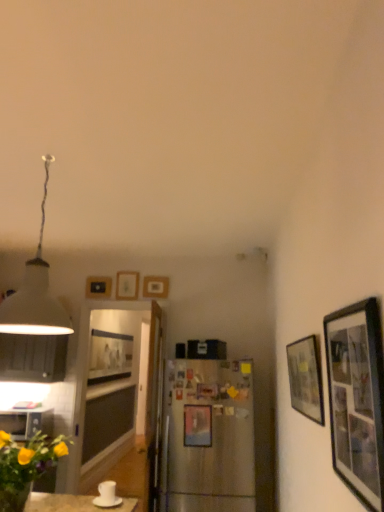
The image size is (384, 512). What do you see at coordinates (25, 466) in the screenshot?
I see `yellow matte flower at lower left` at bounding box center [25, 466].

What do you see at coordinates (35, 293) in the screenshot? Image resolution: width=384 pixels, height=512 pixels. I see `white matte lampshade at upper left` at bounding box center [35, 293].

In order to face matte black picture frame at right, which ranks as the 6th picture frame in back-to-front order, should I rotate leftwards or rightwards?

A 14.645 degree turn to the right will do.

What is the approximate width of matte black picture frame at right, which appears as the 7th picture frame when viewed from the left?

2.04 inches.

The height and width of the screenshot is (512, 384). Identify the location of metallic silver picture frame at center, the third picture frame in the right-to-left sequence. (197, 425).

This screenshot has width=384, height=512. Describe the element at coordinates (208, 437) in the screenshot. I see `satin silver refrigerator at center` at that location.

Image resolution: width=384 pixels, height=512 pixels. I want to click on satin silver refrigerator at center, so click(208, 437).

Locate an element on the screen. The image size is (384, 512). matte wood picture frame at upper center, the 3th picture frame positioned from the left is located at coordinates (127, 285).

Considering the sizes of objects matte black picture frame at right, which ranks as the 6th picture frame in back-to-front order, and matte black picture frame at center, positioned as the seventh picture frame in right-to-left order, in the image provided, who is smaller, matte black picture frame at right, which ranks as the 6th picture frame in back-to-front order, or matte black picture frame at center, positioned as the seventh picture frame in right-to-left order,?

With smaller size is matte black picture frame at right, which ranks as the 6th picture frame in back-to-front order.

Considering the sizes of objects matte black picture frame at right, arranged as the second picture frame when viewed from the front, and matte black picture frame at center, the first picture frame viewed from the left, in the image provided, who is thinner, matte black picture frame at right, arranged as the second picture frame when viewed from the front, or matte black picture frame at center, the first picture frame viewed from the left,?

matte black picture frame at right, arranged as the second picture frame when viewed from the front.

Considering the points (306, 398) and (108, 351), which point is in front, point (306, 398) or point (108, 351)?

The point (306, 398) is closer to the camera.

Between matte wood picture frame at upper center, the third picture frame viewed from the back, and satin silver refrigerator at center, which one appears on the right side from the viewer's perspective?

satin silver refrigerator at center.

Is matte wood picture frame at upper center, the third picture frame viewed from the back, wider or thinner than satin silver refrigerator at center?

Clearly, matte wood picture frame at upper center, the third picture frame viewed from the back, has less width compared to satin silver refrigerator at center.

Does matte wood picture frame at upper center, the third picture frame viewed from the back, turn towards satin silver refrigerator at center?

No, matte wood picture frame at upper center, the third picture frame viewed from the back, is not turned towards satin silver refrigerator at center.

Considering the positions of objects satin silver refrigerator at center and matte black picture frame at center, positioned as the seventh picture frame in right-to-left order, in the image provided, who is more to the left, satin silver refrigerator at center or matte black picture frame at center, positioned as the seventh picture frame in right-to-left order,?

matte black picture frame at center, positioned as the seventh picture frame in right-to-left order, is more to the left.

Can you confirm if satin silver refrigerator at center is shorter than matte black picture frame at center, positioned as the seventh picture frame in right-to-left order?

In fact, satin silver refrigerator at center may be taller than matte black picture frame at center, positioned as the seventh picture frame in right-to-left order.

From the image's perspective, who appears lower, satin silver refrigerator at center or matte black picture frame at center, which appears as the 1th picture frame when viewed from the back?

From the image's view, matte black picture frame at center, which appears as the 1th picture frame when viewed from the back, is below.

Considering the sizes of objects satin silver refrigerator at center and matte black picture frame at center, the first picture frame viewed from the left, in the image provided, who is thinner, satin silver refrigerator at center or matte black picture frame at center, the first picture frame viewed from the left,?

With smaller width is satin silver refrigerator at center.

Looking at their sizes, would you say matte black picture frame at right, which ranks as the 6th picture frame in back-to-front order, is wider or thinner than white matte lampshade at upper left?

matte black picture frame at right, which ranks as the 6th picture frame in back-to-front order, is thinner than white matte lampshade at upper left.

From the image's perspective, is matte black picture frame at right, the 1th picture frame in the right-to-left sequence, below white matte lampshade at upper left?

Yes.

Looking at this image, considering the relative positions of matte black picture frame at right, arranged as the second picture frame when viewed from the front, and white matte lampshade at upper left in the image provided, is matte black picture frame at right, arranged as the second picture frame when viewed from the front, to the left of white matte lampshade at upper left from the viewer's perspective?

No, matte black picture frame at right, arranged as the second picture frame when viewed from the front, is not to the left of white matte lampshade at upper left.

Could you tell me if matte black picture frame at right, which appears as the 7th picture frame when viewed from the left, is turned towards white matte lampshade at upper left?

No, matte black picture frame at right, which appears as the 7th picture frame when viewed from the left, is not aimed at white matte lampshade at upper left.

Does wooden collage frame at right, the seventh picture frame in the back-to-front sequence, turn towards white matte lampshade at upper left?

Yes.

Is wooden collage frame at right, the sixth picture frame from the left, at the left side of white matte lampshade at upper left?

Incorrect, wooden collage frame at right, the sixth picture frame from the left, is not on the left side of white matte lampshade at upper left.

From a real-world perspective, is wooden collage frame at right, positioned as the second picture frame in right-to-left order, physically below white matte lampshade at upper left?

Yes, from a real-world perspective, wooden collage frame at right, positioned as the second picture frame in right-to-left order, is below white matte lampshade at upper left.

Is white matte lampshade at upper left inside wooden collage frame at right, the sixth picture frame from the left?

No, white matte lampshade at upper left is not inside wooden collage frame at right, the sixth picture frame from the left.

Which object is closer to the camera, white glossy coffee cup at lower left or metallic silver picture frame at center, which is the 5th picture frame from left to right?

white glossy coffee cup at lower left is more forward.

From a real-world perspective, starting from the white glossy coffee cup at lower left, which picture frame is the 1st one vertically above it? Please provide its 2D coordinates.

[(197, 425)]

Looking at this image, considering the relative sizes of white glossy coffee cup at lower left and metallic silver picture frame at center, the third picture frame in the right-to-left sequence, in the image provided, is white glossy coffee cup at lower left thinner than metallic silver picture frame at center, the third picture frame in the right-to-left sequence,?

In fact, white glossy coffee cup at lower left might be wider than metallic silver picture frame at center, the third picture frame in the right-to-left sequence.

Considering the sizes of objects white glossy coffee cup at lower left and metallic silver picture frame at center, which appears as the third picture frame when viewed from the front, in the image provided, who is taller, white glossy coffee cup at lower left or metallic silver picture frame at center, which appears as the third picture frame when viewed from the front,?

Standing taller between the two is metallic silver picture frame at center, which appears as the third picture frame when viewed from the front.

Does wooden collage frame at right, the sixth picture frame from the left, turn towards yellow matte flower at lower left?

Yes, wooden collage frame at right, the sixth picture frame from the left, is aimed at yellow matte flower at lower left.

Is wooden collage frame at right, the sixth picture frame from the left, not close to yellow matte flower at lower left?

That's right, there is a large distance between wooden collage frame at right, the sixth picture frame from the left, and yellow matte flower at lower left.

This screenshot has width=384, height=512. Identify the location of the 4th picture frame counting from the right of the yellow matte flower at lower left. (357, 399).

Which is further, (x=376, y=315) or (x=15, y=501)?

The point (x=15, y=501) is behind.

Identify the location of the 6th picture frame counting from the right of the matte black picture frame at center, positioned as the seventh picture frame in right-to-left order. (306, 378).

Find the location of a particular element. This screenshot has height=512, width=384. refrigerator below the matte wood picture frame at upper center, the third picture frame viewed from the back (from a real-world perspective) is located at coordinates click(208, 437).

From the image, which object appears to be nearer to wooden picture frame at upper center, which ranks as the fourth picture frame in left-to-right order, satin silver refrigerator at center or white matte lampshade at upper left?

Among the two, satin silver refrigerator at center is located nearer to wooden picture frame at upper center, which ranks as the fourth picture frame in left-to-right order.

Estimate the real-world distances between objects in this image. Which object is closer to white matte lampshade at upper left, brushed metal microwave at lower left or white glossy coffee cup at lower left?

white glossy coffee cup at lower left lies closer to white matte lampshade at upper left than the other object.

Which object lies nearer to the anchor point wooden picture frame at upper center, which is the 4th picture frame from front to back, matte black picture frame at right, which appears as the 7th picture frame when viewed from the left, or white glossy coffee cup at lower left?

white glossy coffee cup at lower left is positioned closer to the anchor wooden picture frame at upper center, which is the 4th picture frame from front to back.

Considering their positions, is matte black picture frame at center, the first picture frame viewed from the left, positioned further to metallic silver picture frame at center, the 5th picture frame viewed from the back, than matte black picture frame at upper left, positioned as the 6th picture frame in right-to-left order?

matte black picture frame at center, the first picture frame viewed from the left.

Estimate the real-world distances between objects in this image. Which object is further from white matte lampshade at upper left, matte black picture frame at upper left, arranged as the 2th picture frame when viewed from the back, or white glossy saucer at lower center?

matte black picture frame at upper left, arranged as the 2th picture frame when viewed from the back.

Looking at the image, which one is located further to yellow matte flower at lower left, metallic silver picture frame at center, the third picture frame in the right-to-left sequence, or matte black picture frame at right, which ranks as the 6th picture frame in back-to-front order?

Among the two, metallic silver picture frame at center, the third picture frame in the right-to-left sequence, is located further to yellow matte flower at lower left.

Estimate the real-world distances between objects in this image. Which object is closer to white glossy saucer at lower center, matte black picture frame at center, positioned as the seventh picture frame in right-to-left order, or white matte lampshade at upper left?

white matte lampshade at upper left is closer to white glossy saucer at lower center.

Consider the image. Which object lies nearer to the anchor point wooden picture frame at upper center, which is the 4th picture frame from front to back, matte black picture frame at upper left, which ranks as the 2th picture frame in left-to-right order, or white matte lampshade at upper left?

The object closer to wooden picture frame at upper center, which is the 4th picture frame from front to back, is matte black picture frame at upper left, which ranks as the 2th picture frame in left-to-right order.

The width and height of the screenshot is (384, 512). In order to click on refrigerator between wooden collage frame at right, positioned as the second picture frame in right-to-left order, and brushed metal microwave at lower left from front to back in this screenshot , I will do `click(208, 437)`.

I want to click on saucer between yellow matte flower at lower left and wooden collage frame at right, the sixth picture frame from the left, in the horizontal direction, so click(107, 501).

Identify the location of lamp between wooden collage frame at right, positioned as the second picture frame in right-to-left order, and wooden picture frame at upper center, which is the 4th picture frame from front to back, in the front-back direction. (35, 293).

Image resolution: width=384 pixels, height=512 pixels. What are the coordinates of `lamp positioned between yellow matte flower at lower left and matte black picture frame at center, the first picture frame viewed from the left, from near to far` in the screenshot? It's located at (35, 293).